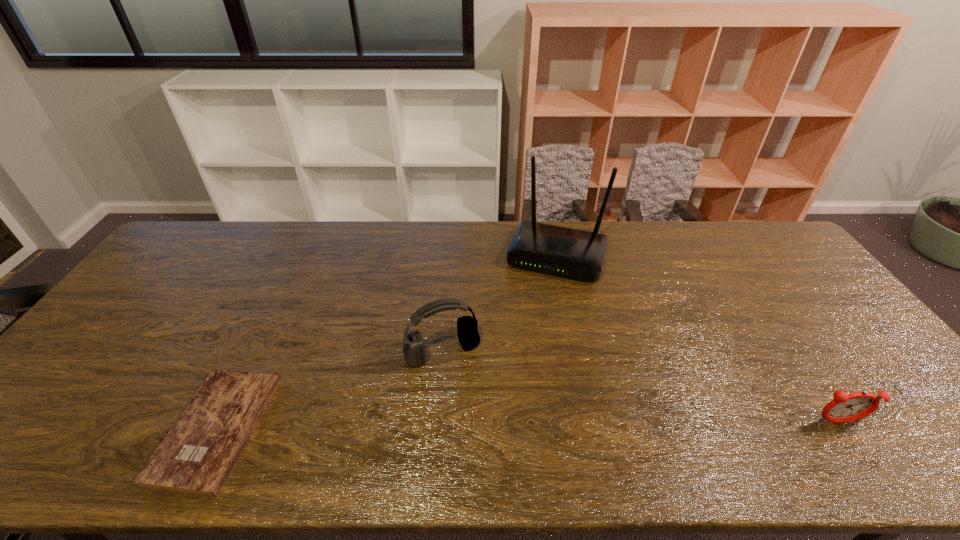
You are a GUI agent. You are given a task and a screenshot of the screen. Output one action in this format:
    pyautogui.click(x=<x>, y=<y>)
    Task: Click on the leftmost object
    Image resolution: width=960 pixels, height=540 pixels.
    Given the screenshot: What is the action you would take?
    pyautogui.click(x=199, y=452)

At what (x,y) coordinates should I click in order to perform the action: click on the shortest object. Please return your answer as a coordinate pair (x, y). Looking at the image, I should click on (199, 452).

This screenshot has width=960, height=540. I want to click on the third tallest object, so click(x=845, y=408).

Locate an element on the screen. The width and height of the screenshot is (960, 540). alarm clock is located at coordinates (845, 408).

Find the location of a particular element. The image size is (960, 540). headset is located at coordinates (467, 327).

This screenshot has height=540, width=960. In order to click on the second object from left to right in this screenshot , I will do 467,327.

This screenshot has width=960, height=540. Find the location of `the farthest object`. the farthest object is located at coordinates (568, 252).

I want to click on the tallest object, so click(x=568, y=252).

The image size is (960, 540). Identify the location of free space located on the back of the Bible. (278, 303).

Where is `vacant space positioned 0.120m on the headband of the headset`? The width and height of the screenshot is (960, 540). vacant space positioned 0.120m on the headband of the headset is located at coordinates (473, 406).